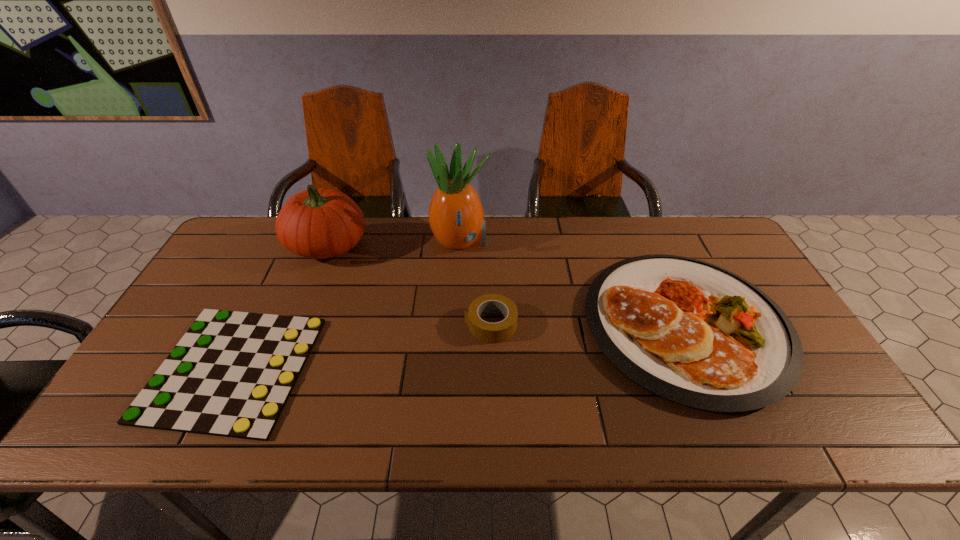
This screenshot has width=960, height=540. Identify the location of the tallest object. (456, 217).

You are a GUI agent. You are given a task and a screenshot of the screen. Output one action in this format:
    pyautogui.click(x=<x>, y=<y>)
    Task: Click on the second tallest object
    
    Given the screenshot: What is the action you would take?
    pyautogui.click(x=318, y=223)

At what (x,y) coordinates should I click in order to perform the action: click on the third shortest object. Please return your answer as a coordinate pair (x, y). Looking at the image, I should click on (693, 333).

I want to click on dish, so click(693, 333).

Locate an element on the screen. The height and width of the screenshot is (540, 960). duct tape is located at coordinates (488, 332).

This screenshot has width=960, height=540. I want to click on the shortest object, so click(x=231, y=374).

Locate an element on the screen. This screenshot has height=540, width=960. vacant position located at the entrance of the tallest object is located at coordinates (588, 241).

Find the location of a particular element. free space located on the right of the second tallest object is located at coordinates (448, 245).

You are a GUI agent. You are given a task and a screenshot of the screen. Output one action in this format:
    pyautogui.click(x=<x>, y=<y>)
    Task: Click on the vacant area located 0.140m on the back of the third shortest object
    
    Given the screenshot: What is the action you would take?
    tap(644, 233)

The width and height of the screenshot is (960, 540). Find the location of `free space located at the edge of the duct tape`. free space located at the edge of the duct tape is located at coordinates (413, 324).